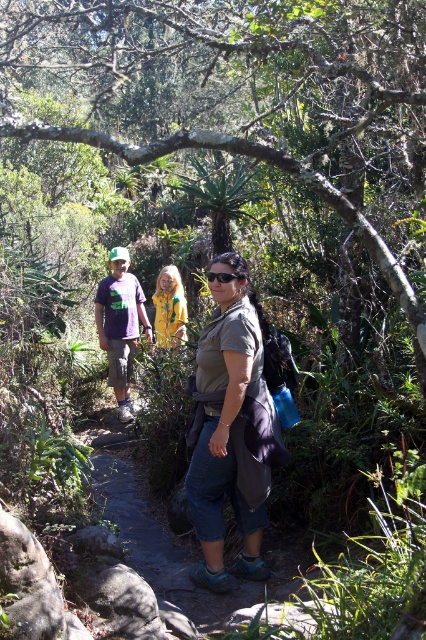
Does purple cotton shirt at center have a lesser height compared to black matte goggles at center?

Incorrect, purple cotton shirt at center's height does not fall short of black matte goggles at center's.

Who is taller, purple cotton shirt at center or black matte goggles at center?

purple cotton shirt at center is taller.

Measure the distance between point [131,280] and camera.

Point [131,280] is 7.55 meters away from camera.

This screenshot has width=426, height=640. I want to click on purple cotton shirt at center, so click(120, 324).

Which of these two, matte khaki shirt at center or purple cotton shirt at center, stands shorter?

purple cotton shirt at center

Looking at this image, measure the distance from matte khaki shirt at center to purple cotton shirt at center.

3.43 meters

Is point (227, 364) in front of point (112, 371)?

Yes, it is in front of point (112, 371).

I want to click on matte khaki shirt at center, so click(x=230, y=429).

Which is above, yellow fabric jacket at center or black matte goggles at center?

black matte goggles at center is higher up.

The image size is (426, 640). What do you see at coordinates (169, 307) in the screenshot? I see `yellow fabric jacket at center` at bounding box center [169, 307].

Between point (161, 282) and point (241, 278), which one is positioned in front?

Point (241, 278)

The image size is (426, 640). I want to click on yellow fabric jacket at center, so click(169, 307).